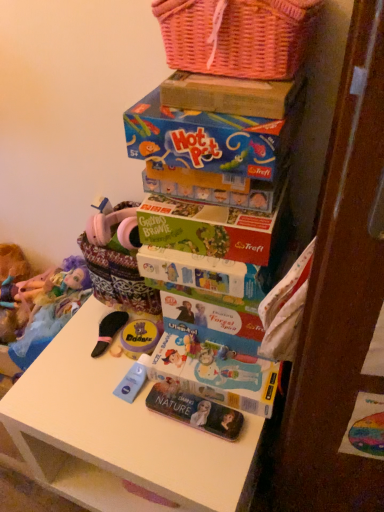
This screenshot has height=512, width=384. What do you see at coordinates (236, 36) in the screenshot? I see `pink wicker basket at upper center` at bounding box center [236, 36].

Where is `metallic silver magazine at lower center`? The image size is (384, 512). metallic silver magazine at lower center is located at coordinates (195, 411).

What are the coordinates of `matte yellow container at center, positioned as the first toy in right-to-left order` in the screenshot? It's located at (139, 337).

Is white matte table at center aimed at cardboard box at upper center?

No, white matte table at center is not oriented towards cardboard box at upper center.

Is white matte table at center thinner than cardboard box at upper center?

Incorrect, the width of white matte table at center is not less than that of cardboard box at upper center.

In the scene shown: Is white matte table at center not near cardboard box at upper center?

No, there isn't a large distance between white matte table at center and cardboard box at upper center.

From a real-world perspective, is white matte table at center positioned over cardboard box at upper center based on gravity?

Actually, white matte table at center is physically below cardboard box at upper center in the real world.

Locate an element on the screen. basket in front of the green matte board game at center is located at coordinates (236, 36).

From the picture: What's the angular difference between green matte board game at center and pink wicker basket at upper center's facing directions?

6.48 degrees separate the facing orientations of green matte board game at center and pink wicker basket at upper center.

Is green matte board game at center oriented away from pink wicker basket at upper center?

green matte board game at center does not have its back to pink wicker basket at upper center.

How distant is green matte board game at center from pink wicker basket at upper center?

green matte board game at center and pink wicker basket at upper center are 27.60 centimeters apart from each other.

Is cardboard box at upper center shorter than blue cardboard hot pot game at upper center?

Yes, cardboard box at upper center is shorter than blue cardboard hot pot game at upper center.

Could you tell me if cardboard box at upper center is facing blue cardboard hot pot game at upper center?

No, cardboard box at upper center is not aimed at blue cardboard hot pot game at upper center.

Which is more to the left, cardboard box at upper center or blue cardboard hot pot game at upper center?

From the viewer's perspective, blue cardboard hot pot game at upper center appears more on the left side.

Considering the sizes of cardboard box at upper center and blue cardboard hot pot game at upper center in the image, is cardboard box at upper center wider or thinner than blue cardboard hot pot game at upper center?

Considering their sizes, cardboard box at upper center looks slimmer than blue cardboard hot pot game at upper center.

Which point is more distant from viewer, (x=184, y=243) or (x=147, y=320)?

Positioned behind is point (x=147, y=320).

Looking at their sizes, would you say green matte board game at center is wider or thinner than matte yellow container at center, acting as the 1th toy starting from the front?

In the image, green matte board game at center appears to be wider than matte yellow container at center, acting as the 1th toy starting from the front.

The image size is (384, 512). I want to click on book that appears above the matte yellow container at center, marked as the 2th toy in a back-to-front arrangement (from the image's perspective), so click(208, 229).

Identify the location of cardboard box that appears above the plush doll at left, marked as the 1th toy in a left-to-right arrangement (from a real-world perspective). tap(229, 95).

In the scene shown: From the image's perspective, is plush doll at left, which is the first toy in back-to-front order, above cardboard box at upper center?

No, from the image's perspective, plush doll at left, which is the first toy in back-to-front order, is not above cardboard box at upper center.

Can you confirm if plush doll at left, acting as the 2th toy starting from the right, is thinner than cardboard box at upper center?

Yes.

Which of these two, pink wicker basket at upper center or cardboard box at upper center, is bigger?

With larger size is pink wicker basket at upper center.

Based on their positions, is pink wicker basket at upper center located to the left or right of cardboard box at upper center?

pink wicker basket at upper center is to the left of cardboard box at upper center.

Considering the positions of points (188, 59) and (181, 92), is point (188, 59) farther from camera compared to point (181, 92)?

That is True.

Is cardboard box at upper center completely or partially inside pink wicker basket at upper center?

Definitely not — cardboard box at upper center is not inside pink wicker basket at upper center.

Between metallic silver magazine at lower center and blue cardboard hot pot game at upper center, which one has larger size?

blue cardboard hot pot game at upper center is bigger.

Would you say metallic silver magazine at lower center is outside blue cardboard hot pot game at upper center?

Yes.

Are metallic silver magazine at lower center and blue cardboard hot pot game at upper center making contact?

No, metallic silver magazine at lower center is not in contact with blue cardboard hot pot game at upper center.

Who is shorter, metallic silver magazine at lower center or blue cardboard hot pot game at upper center?

metallic silver magazine at lower center is shorter.

The width and height of the screenshot is (384, 512). What are the coordinates of `cardboard box above the white matte table at center (from the image's perspective)` in the screenshot? It's located at (229, 95).

Identify the location of book on the left of pink wicker basket at upper center. The height and width of the screenshot is (512, 384). (208, 229).

Estimate the real-world distances between objects in this image. Which object is closer to matt paper comic book at center, pink wicker basket at upper center or white matte table at center?

white matte table at center is closer to matt paper comic book at center.

Considering their positions, is pink wicker basket at upper center positioned closer to matt paper comic book at center than blue cardboard hot pot game at upper center?

blue cardboard hot pot game at upper center lies closer to matt paper comic book at center than the other object.

Based on their spatial positions, is cardboard box at upper center or green matte board game at center closer to matte yellow container at center, marked as the 2th toy in a back-to-front arrangement?

The object closer to matte yellow container at center, marked as the 2th toy in a back-to-front arrangement, is green matte board game at center.

Which object lies further to the anchor point pink wicker basket at upper center, matte yellow container at center, marked as the 2th toy in a back-to-front arrangement, or metallic silver magazine at lower center?

The object further to pink wicker basket at upper center is metallic silver magazine at lower center.

From the image, which object appears to be farther from plush doll at left, marked as the 1th toy in a left-to-right arrangement, metallic silver magazine at lower center or white matte table at center?

metallic silver magazine at lower center lies further to plush doll at left, marked as the 1th toy in a left-to-right arrangement, than the other object.

Based on their spatial positions, is cardboard box at upper center or metallic silver magazine at lower center further from pink wicker basket at upper center?

Based on the image, metallic silver magazine at lower center appears to be further to pink wicker basket at upper center.

Based on their spatial positions, is plush doll at left, acting as the 2th toy starting from the right, or cardboard box at upper center closer to green matte board game at center?

The object closer to green matte board game at center is cardboard box at upper center.

Estimate the real-world distances between objects in this image. Which object is further from white matte table at center, blue cardboard hot pot game at upper center or matte yellow container at center, marked as the 2th toy in a back-to-front arrangement?

blue cardboard hot pot game at upper center lies further to white matte table at center than the other object.

The image size is (384, 512). Find the location of `book between pink wicker basket at upper center and plush doll at left, acting as the 2th toy starting from the right, along the z-axis`. book between pink wicker basket at upper center and plush doll at left, acting as the 2th toy starting from the right, along the z-axis is located at coordinates (208, 229).

You are a GUI agent. You are given a task and a screenshot of the screen. Output one action in this format:
    pyautogui.click(x=<x>, y=<y>)
    Task: Click on the magazine between matte yellow container at center, marked as the 2th toy in a back-to-front arrangement, and matt paper comic book at center from left to right
    The height and width of the screenshot is (512, 384).
    Given the screenshot: What is the action you would take?
    coord(195,411)

The image size is (384, 512). What are the coordinates of `cardboard box between pink wicker basket at upper center and blue cardboard hot pot game at upper center vertically` in the screenshot? It's located at (229, 95).

Find the location of a particular element. comic book between blue cardboard hot pot game at upper center and metallic silver magazine at lower center vertically is located at coordinates (215, 372).